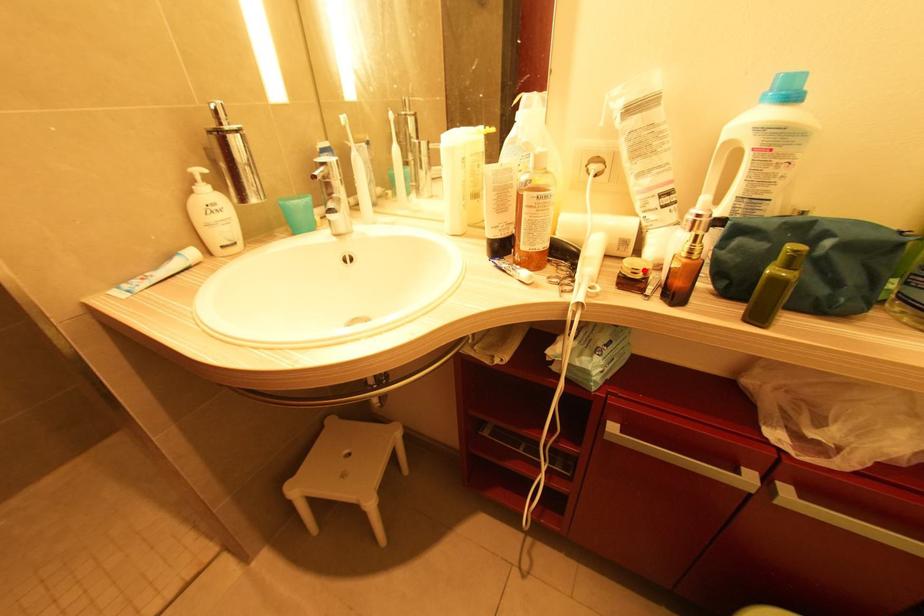
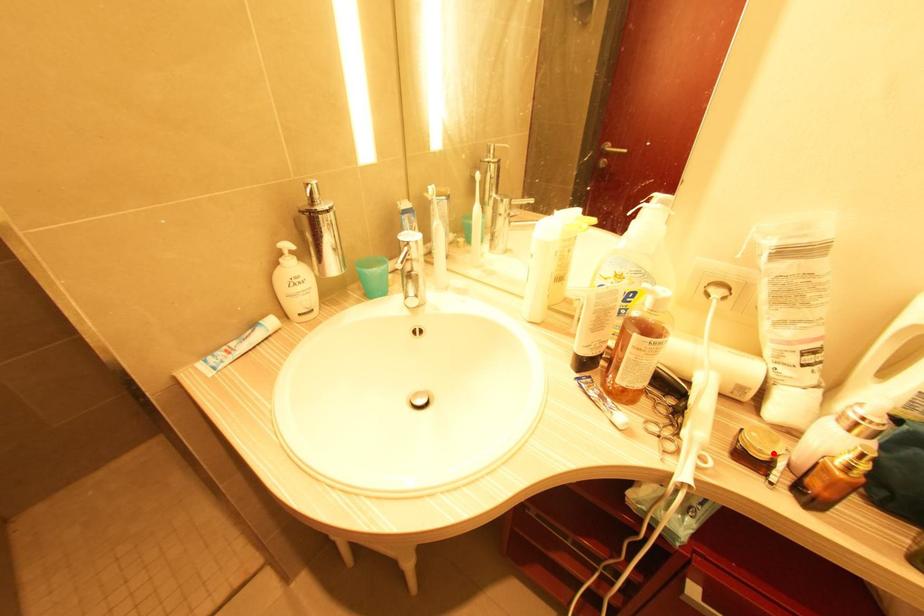
I am providing you with two images of the same scene from different viewpoints. A red point is marked on the first image and another point is marked on the second image. Is the red point in image1 aligned with the point shown in image2?

Yes